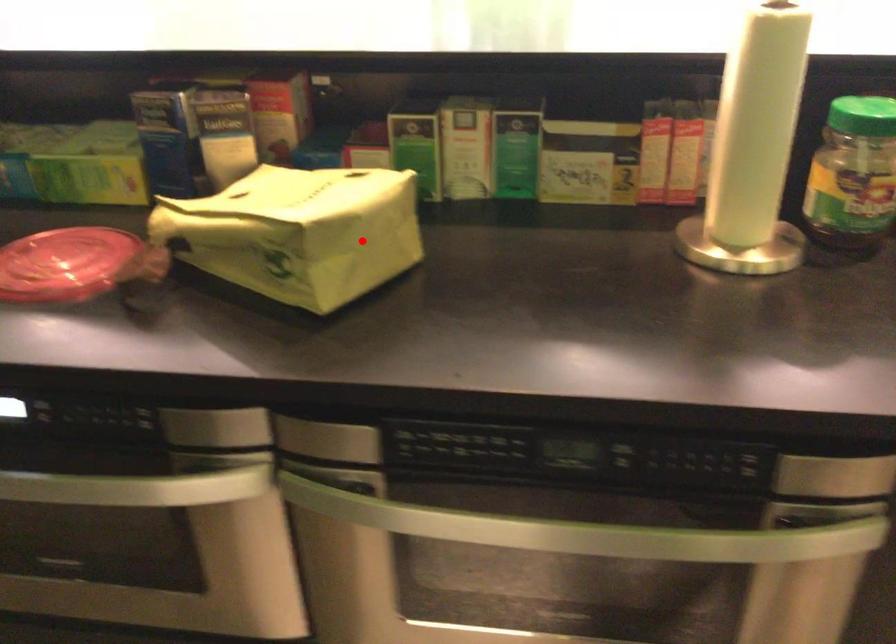
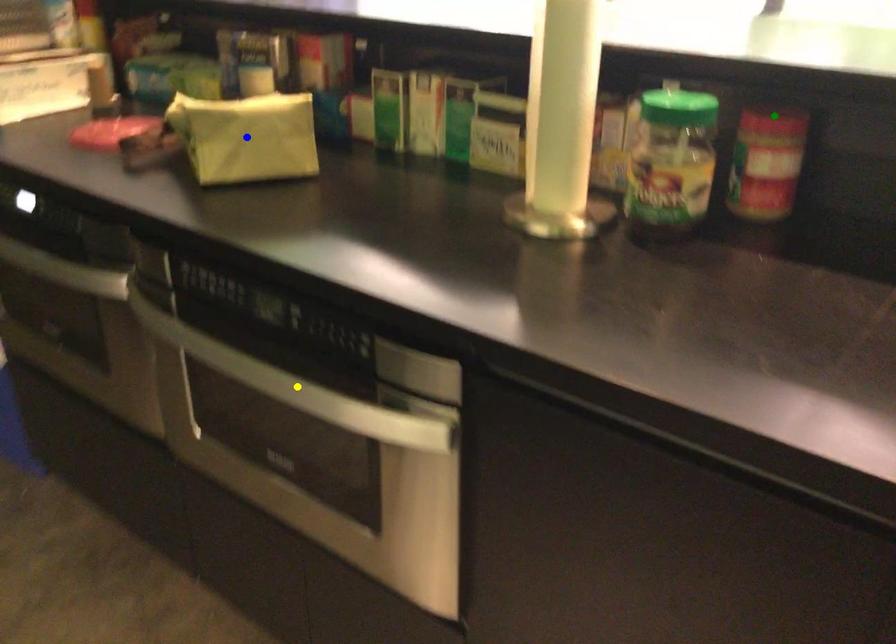
Question: I am providing you with two images of the same scene from different viewpoints. A red point is marked on the first image. You are given multiple points on the second image. Can you choose the point in image 2 that corresponds to the point in image 1?

Choices:
 (A) green point
 (B) yellow point
 (C) blue point

Answer: (C)